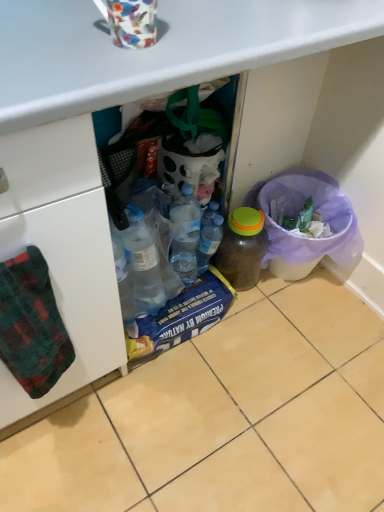
Where is `free space in front of floral-patterned ceramic mug at upper center`? Image resolution: width=384 pixels, height=512 pixels. free space in front of floral-patterned ceramic mug at upper center is located at coordinates (98, 72).